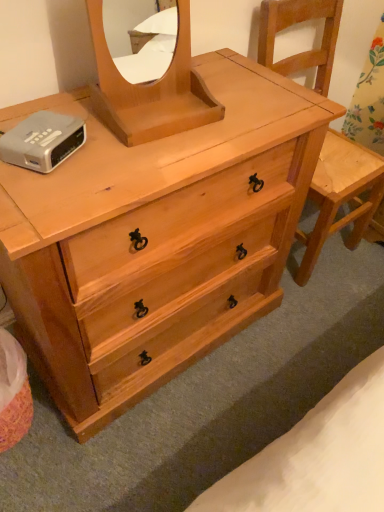
Question: Can silver metallic alarm clock at upper left be found inside natural wood mirror at center?

Choices:
 (A) no
 (B) yes

Answer: (A)

Question: From a real-world perspective, does natural wood mirror at center sit lower than silver metallic alarm clock at upper left?

Choices:
 (A) yes
 (B) no

Answer: (B)

Question: From a real-world perspective, is natural wood mirror at center physically above silver metallic alarm clock at upper left?

Choices:
 (A) no
 (B) yes

Answer: (B)

Question: Is natural wood mirror at center at the left side of silver metallic alarm clock at upper left?

Choices:
 (A) no
 (B) yes

Answer: (A)

Question: Can you confirm if natural wood mirror at center is shorter than silver metallic alarm clock at upper left?

Choices:
 (A) yes
 (B) no

Answer: (B)

Question: Is natural wood mirror at center taller than silver metallic alarm clock at upper left?

Choices:
 (A) yes
 (B) no

Answer: (A)

Question: Can you confirm if silver metallic alarm clock at upper left is wider than natural wood chair at right?

Choices:
 (A) no
 (B) yes

Answer: (A)

Question: Is silver metallic alarm clock at upper left smaller than natural wood chair at right?

Choices:
 (A) yes
 (B) no

Answer: (A)

Question: Is silver metallic alarm clock at upper left bigger than natural wood chair at right?

Choices:
 (A) yes
 (B) no

Answer: (B)

Question: From the image's perspective, is silver metallic alarm clock at upper left under natural wood chair at right?

Choices:
 (A) no
 (B) yes

Answer: (B)

Question: Does silver metallic alarm clock at upper left have a lesser width compared to natural wood chair at right?

Choices:
 (A) no
 (B) yes

Answer: (B)

Question: Is natural wood chair at right a part of silver metallic alarm clock at upper left?

Choices:
 (A) yes
 (B) no

Answer: (B)

Question: Does silver metallic alarm clock at upper left have a lesser width compared to natural wood mirror at center?

Choices:
 (A) yes
 (B) no

Answer: (A)